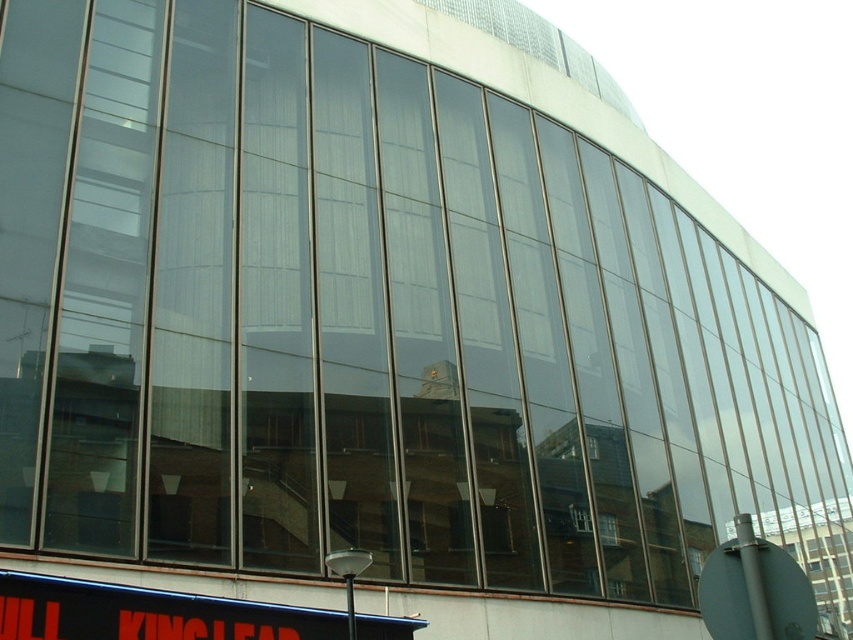
You are standing in front of the modern building and want to find the black plastic sign at lower left. Based on the coordinates provided, where should you look relative to the building?

The black plastic sign at lower left is located at point coordinates 0.959 on the x axis and 0.174 on the y axis, so you should look towards the lower left area near the bottom edge of the image, close to the building base.

You are a city planner reviewing this building design. You need to determine which sign, the black plastic sign at lower left or the metallic gray sign at lower right, requires more maintenance due to its size. Which one would you prioritize?

The black plastic sign at lower left requires more maintenance because it is larger in size than the metallic gray sign at lower right.